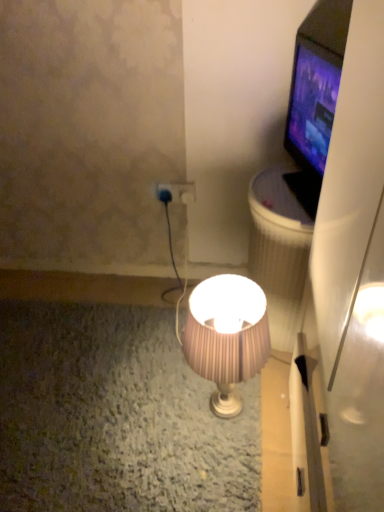
Measure the distance between point [184,189] and camera.

A distance of 5.50 feet exists between point [184,189] and camera.

Describe the element at coordinates (180, 191) in the screenshot. I see `blue plastic plug at center` at that location.

In order to face white textured trash can at right, should I rotate leftwards or rightwards?

You should look right and rotate roughly 11.434 degrees.

Image resolution: width=384 pixels, height=512 pixels. Identify the location of pink pleated fabric lampshade at center. (227, 336).

Consider the image. Are blue plastic plug at center and pink pleated fabric lampshade at center making contact?

blue plastic plug at center and pink pleated fabric lampshade at center are not in contact.

Is blue plastic plug at center aimed at pink pleated fabric lampshade at center?

Yes.

Considering the sizes of blue plastic plug at center and pink pleated fabric lampshade at center in the image, is blue plastic plug at center wider or thinner than pink pleated fabric lampshade at center?

In the image, blue plastic plug at center appears to be more narrow than pink pleated fabric lampshade at center.

From a real-world perspective, is blue plastic plug at center positioned over matte black tv at upper right based on gravity?

No.

From the image's perspective, is blue plastic plug at center below matte black tv at upper right?

Yes.

Is point (184, 192) positioned before point (336, 92)?

No, (184, 192) is behind (336, 92).

Find the location of a particular element. television on the right of the blue plastic plug at center is located at coordinates (315, 96).

Is point (250, 238) closer or farther from the camera than point (251, 309)?

Point (250, 238) appears to be farther away from the viewer than point (251, 309).

Could you tell me if white textured trash can at right is facing pink pleated fabric lampshade at center?

No, white textured trash can at right is not facing towards pink pleated fabric lampshade at center.

Relative to pink pleated fabric lampshade at center, is white textured trash can at right in front or behind?

Visually, white textured trash can at right is located behind pink pleated fabric lampshade at center.

Can you confirm if white textured trash can at right is smaller than pink pleated fabric lampshade at center?

Incorrect, white textured trash can at right is not smaller in size than pink pleated fabric lampshade at center.

In order to click on power plugs and sockets above the white textured trash can at right (from the image's perspective) in this screenshot , I will do `click(180, 191)`.

Is white textured trash can at right bigger or smaller than blue plastic plug at center?

In the image, white textured trash can at right appears to be larger than blue plastic plug at center.

Considering their positions, is white textured trash can at right located in front of or behind blue plastic plug at center?

In the image, white textured trash can at right appears in front of blue plastic plug at center.

Consider the image. How many degrees apart are the facing directions of white textured trash can at right and blue plastic plug at center?

92.1 degrees separate the facing orientations of white textured trash can at right and blue plastic plug at center.

Is blue plastic plug at center aimed at white textured trash can at right?

No, blue plastic plug at center is not turned towards white textured trash can at right.

Considering the sizes of objects blue plastic plug at center and white textured trash can at right in the image provided, who is bigger, blue plastic plug at center or white textured trash can at right?

Bigger between the two is white textured trash can at right.

Is blue plastic plug at center positioned beyond the bounds of white textured trash can at right?

Yes, blue plastic plug at center is located beyond the bounds of white textured trash can at right.

Is point (177, 189) behind point (271, 167)?

That is True.

Looking at this image, from the image's perspective, between pink pleated fabric lampshade at center and matte black tv at upper right, which one is located above?

matte black tv at upper right.

Can we say pink pleated fabric lampshade at center lies outside matte black tv at upper right?

Indeed, pink pleated fabric lampshade at center is completely outside matte black tv at upper right.

At what (x,y) coordinates should I click in order to perform the action: click on lamp on the left of matte black tv at upper right. Please return your answer as a coordinate pair (x, y). Looking at the image, I should click on (227, 336).

Considering the relative positions of pink pleated fabric lampshade at center and matte black tv at upper right in the image provided, is pink pleated fabric lampshade at center behind matte black tv at upper right?

No, pink pleated fabric lampshade at center is closer to the camera.

Is white textured trash can at right inside or outside of matte black tv at upper right?

white textured trash can at right lies outside matte black tv at upper right.

Between white textured trash can at right and matte black tv at upper right, which one has larger size?

Bigger between the two is white textured trash can at right.

Based on the photo, from the image's perspective, would you say white textured trash can at right is positioned over matte black tv at upper right?

No, from the image's perspective, white textured trash can at right is not above matte black tv at upper right.

Is white textured trash can at right directly adjacent to matte black tv at upper right?

No.

Locate an element on the screen. This screenshot has height=512, width=384. power plugs and sockets on the left of pink pleated fabric lampshade at center is located at coordinates (180, 191).

Where is `television above the blue plastic plug at center (from the image's perspective)`? television above the blue plastic plug at center (from the image's perspective) is located at coordinates (315, 96).

Based on their spatial positions, is white textured trash can at right or pink pleated fabric lampshade at center closer to blue plastic plug at center?

white textured trash can at right is positioned closer to the anchor blue plastic plug at center.

Based on the photo, based on their spatial positions, is blue plastic plug at center or matte black tv at upper right closer to white textured trash can at right?

matte black tv at upper right lies closer to white textured trash can at right than the other object.

Which object lies further to the anchor point blue plastic plug at center, pink pleated fabric lampshade at center or white textured trash can at right?

The object further to blue plastic plug at center is pink pleated fabric lampshade at center.

Based on their spatial positions, is matte black tv at upper right or white textured trash can at right further from blue plastic plug at center?

matte black tv at upper right is positioned further to the anchor blue plastic plug at center.

Considering their positions, is blue plastic plug at center positioned closer to matte black tv at upper right than white textured trash can at right?

Among the two, white textured trash can at right is located nearer to matte black tv at upper right.

Estimate the real-world distances between objects in this image. Which object is further from pink pleated fabric lampshade at center, white textured trash can at right or blue plastic plug at center?

The object further to pink pleated fabric lampshade at center is blue plastic plug at center.

When comparing their distances from pink pleated fabric lampshade at center, does blue plastic plug at center or matte black tv at upper right seem closer?

matte black tv at upper right lies closer to pink pleated fabric lampshade at center than the other object.

Estimate the real-world distances between objects in this image. Which object is closer to white textured trash can at right, matte black tv at upper right or blue plastic plug at center?

matte black tv at upper right is closer to white textured trash can at right.

Locate an element on the screen. Image resolution: width=384 pixels, height=512 pixels. trash bin/can between matte black tv at upper right and pink pleated fabric lampshade at center vertically is located at coordinates (279, 251).

Identify the location of trash bin/can between pink pleated fabric lampshade at center and blue plastic plug at center in the front-back direction. (279, 251).

At what (x,y) coordinates should I click in order to perform the action: click on trash bin/can between matte black tv at upper right and blue plastic plug at center in the front-back direction. Please return your answer as a coordinate pair (x, y). Looking at the image, I should click on (279, 251).

Find the location of a particular element. The width and height of the screenshot is (384, 512). power plugs and sockets between matte black tv at upper right and pink pleated fabric lampshade at center vertically is located at coordinates (180, 191).